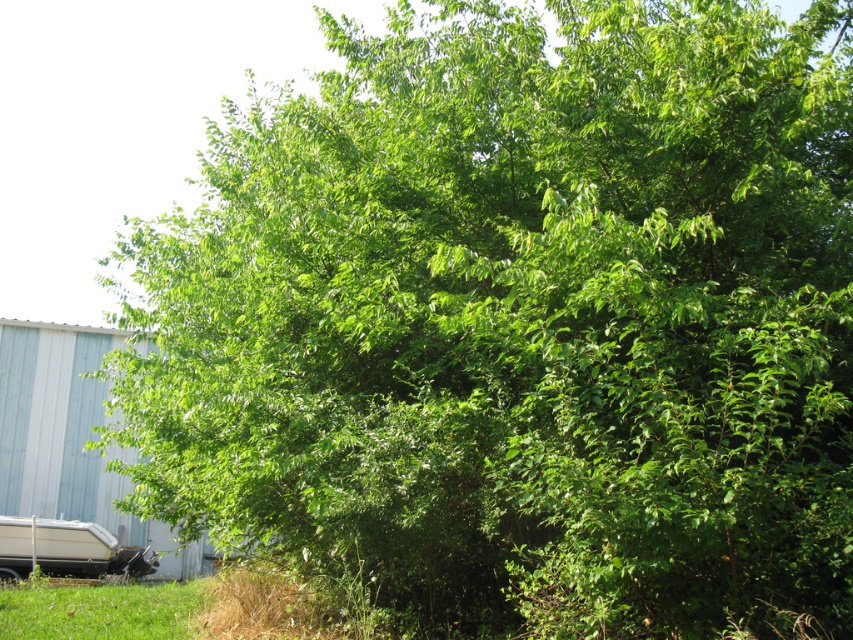
You are planning to place a small garden ornament that requires at least 1 square meter of space. Looking at the image, which area between the green grass at lower left and the white glossy boat at lower left would be suitable for placing the ornament?

The white glossy boat at lower left has a larger area compared to the green grass at lower left, so placing the ornament on the white glossy boat at lower left would be suitable as it provides enough space.